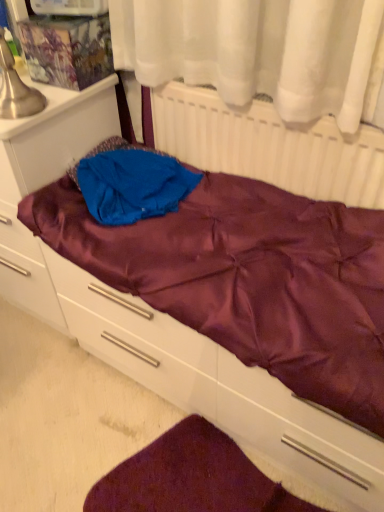
Where is `satin purple drawer at lower center`? The height and width of the screenshot is (512, 384). satin purple drawer at lower center is located at coordinates (221, 389).

Describe the element at coordinates (269, 146) in the screenshot. I see `white matte radiator at upper center` at that location.

Where is `velvety maroon mat at lower center`? velvety maroon mat at lower center is located at coordinates (191, 477).

From a real-world perspective, which object stands above the other?

From a 3D spatial view, white matte radiator at upper center is above.

Is white matte radiator at upper center facing towards blue fabric at center?

Yes, white matte radiator at upper center is turned towards blue fabric at center.

Would you say white matte radiator at upper center is to the left or to the right of blue fabric at center in the picture?

white matte radiator at upper center is positioned on blue fabric at center's right side.

Is white matte radiator at upper center inside or outside of blue fabric at center?

The correct answer is: outside.

From the image's perspective, which one is positioned lower, velvety maroon mat at lower center or satin purple drawer at lower center?

velvety maroon mat at lower center.

Can you confirm if velvety maroon mat at lower center is smaller than satin purple drawer at lower center?

Correct, velvety maroon mat at lower center occupies less space than satin purple drawer at lower center.

Is velvety maroon mat at lower center oriented towards satin purple drawer at lower center?

No.

Considering the relative positions of velvety maroon mat at lower center and satin purple drawer at lower center in the image provided, is velvety maroon mat at lower center behind satin purple drawer at lower center?

Yes, velvety maroon mat at lower center is further from the camera.

How different are the orientations of satin purple drawer at lower center and velvety maroon mat at lower center in degrees?

0.215 degrees separate the facing orientations of satin purple drawer at lower center and velvety maroon mat at lower center.

Locate an element on the screen. drawer above the velvety maroon mat at lower center (from a real-world perspective) is located at coordinates (221, 389).

Can you confirm if satin purple drawer at lower center is smaller than velvety maroon mat at lower center?

No, satin purple drawer at lower center is not smaller than velvety maroon mat at lower center.

Would you say satin purple drawer at lower center contains velvety maroon mat at lower center?

No, velvety maroon mat at lower center is located outside of satin purple drawer at lower center.

Identify the location of drawer beneath the blue fabric at center (from a real-world perspective). This screenshot has height=512, width=384. (221, 389).

Considering the relative sizes of blue fabric at center and satin purple drawer at lower center in the image provided, is blue fabric at center smaller than satin purple drawer at lower center?

Indeed, blue fabric at center has a smaller size compared to satin purple drawer at lower center.

Is blue fabric at center positioned with its back to satin purple drawer at lower center?

No, blue fabric at center's orientation is not away from satin purple drawer at lower center.

Based on the photo, can you confirm if white matte radiator at upper center is positioned to the left of velvety maroon mat at lower center?

In fact, white matte radiator at upper center is to the right of velvety maroon mat at lower center.

Considering the sizes of white matte radiator at upper center and velvety maroon mat at lower center in the image, is white matte radiator at upper center bigger or smaller than velvety maroon mat at lower center?

Considering their sizes, white matte radiator at upper center takes up more space than velvety maroon mat at lower center.

Considering the sizes of white matte radiator at upper center and velvety maroon mat at lower center in the image, is white matte radiator at upper center wider or thinner than velvety maroon mat at lower center?

white matte radiator at upper center is thinner than velvety maroon mat at lower center.

Could satin purple file cabinet at left be considered to be inside velvety maroon mat at lower center?

Definitely not — satin purple file cabinet at left is not inside velvety maroon mat at lower center.

Is velvety maroon mat at lower center wider or thinner than satin purple file cabinet at left?

velvety maroon mat at lower center is thinner than satin purple file cabinet at left.

Between velvety maroon mat at lower center and satin purple file cabinet at left, which one has larger size?

With larger size is satin purple file cabinet at left.

Considering the sizes of objects velvety maroon mat at lower center and satin purple file cabinet at left in the image provided, who is taller, velvety maroon mat at lower center or satin purple file cabinet at left?

satin purple file cabinet at left.

From the image's perspective, which one is positioned higher, blue fabric at center or white matte radiator at upper center?

white matte radiator at upper center.

Is blue fabric at center completely or partially outside of white matte radiator at upper center?

That's correct, blue fabric at center is outside of white matte radiator at upper center.

Which of these two, blue fabric at center or white matte radiator at upper center, is wider?

With larger width is blue fabric at center.

I want to click on radiator lying in front of the blue fabric at center, so pos(269,146).

Locate an element on the screen. This screenshot has height=512, width=384. drawer above the velvety maroon mat at lower center (from a real-world perspective) is located at coordinates (221, 389).

Based on their spatial positions, is satin purple file cabinet at left or blue fabric at center further from satin purple drawer at lower center?

satin purple file cabinet at left.

When comparing their distances from velvety maroon mat at lower center, does satin purple file cabinet at left or white matte radiator at upper center seem closer?

satin purple file cabinet at left is closer to velvety maroon mat at lower center.

Looking at the image, which one is located further to velvety maroon mat at lower center, satin purple drawer at lower center or blue fabric at center?

Based on the image, blue fabric at center appears to be further to velvety maroon mat at lower center.

When comparing their distances from velvety maroon mat at lower center, does satin purple file cabinet at left or satin purple drawer at lower center seem closer?

satin purple drawer at lower center.

From the image, which object appears to be nearer to white matte radiator at upper center, satin purple drawer at lower center or satin purple file cabinet at left?

satin purple file cabinet at left lies closer to white matte radiator at upper center than the other object.

Based on their spatial positions, is velvety maroon mat at lower center or satin purple file cabinet at left further from satin purple drawer at lower center?

satin purple file cabinet at left is further to satin purple drawer at lower center.

Considering their positions, is blue fabric at center positioned further to satin purple drawer at lower center than satin purple file cabinet at left?

satin purple file cabinet at left is positioned further to the anchor satin purple drawer at lower center.

Consider the image. From the image, which object appears to be nearer to satin purple file cabinet at left, velvety maroon mat at lower center or blue fabric at center?

blue fabric at center is positioned closer to the anchor satin purple file cabinet at left.

Where is `clothing between satin purple file cabinet at left and velvety maroon mat at lower center from top to bottom`? clothing between satin purple file cabinet at left and velvety maroon mat at lower center from top to bottom is located at coordinates (131, 183).

The height and width of the screenshot is (512, 384). Identify the location of drawer between blue fabric at center and velvety maroon mat at lower center in the vertical direction. (221, 389).

Find the location of a particular element. The height and width of the screenshot is (512, 384). drawer located between satin purple file cabinet at left and white matte radiator at upper center in the left-right direction is located at coordinates (221, 389).

Identify the location of clothing between white matte radiator at upper center and satin purple drawer at lower center vertically. (131, 183).